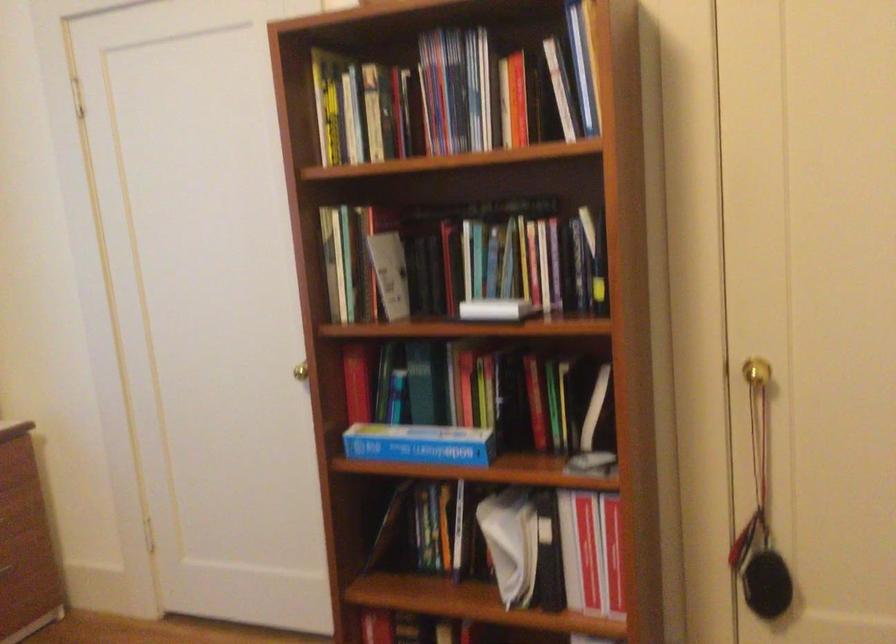
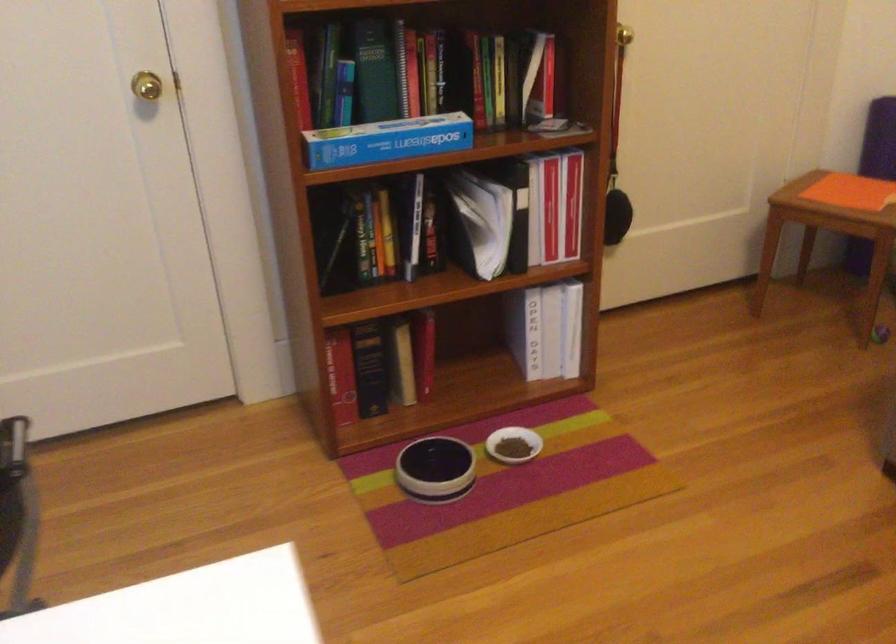
Where in the second image is the point corresponding to (778,366) from the first image?

(624, 35)